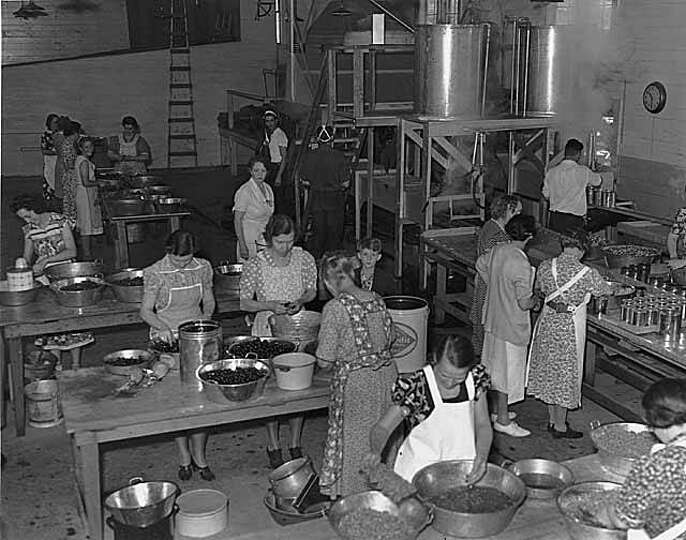
The height and width of the screenshot is (540, 686). In order to click on power cord in this screenshot , I will do `click(650, 133)`.